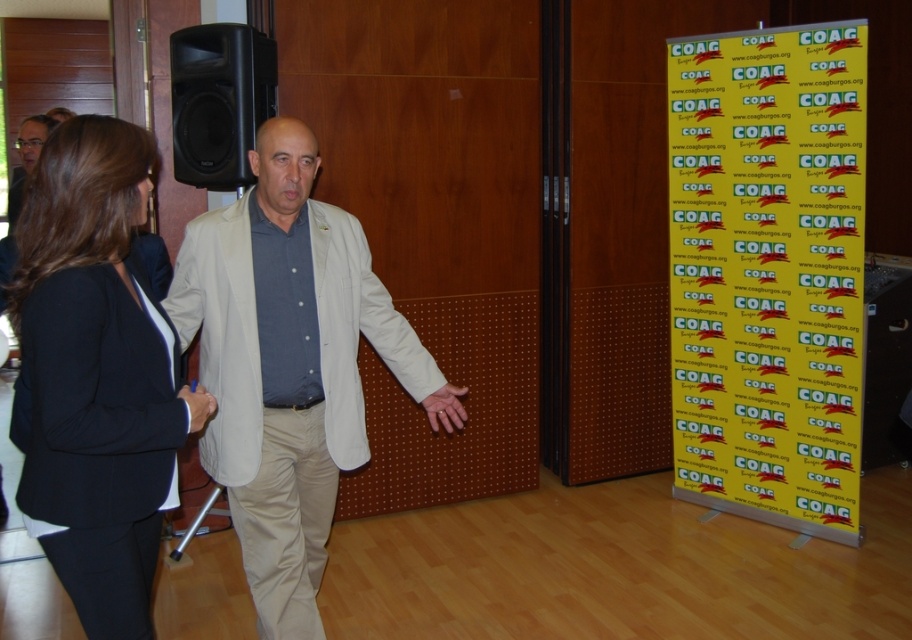
You are standing at the camera position and want to reach point (123, 209). Can you walk directly to it without moving around any obstacles?

The distance between point (123, 209) and the camera is 5.64 feet, so yes, you can walk directly to it without needing to move around obstacles as there are no mentioned obstacles in the scene description.